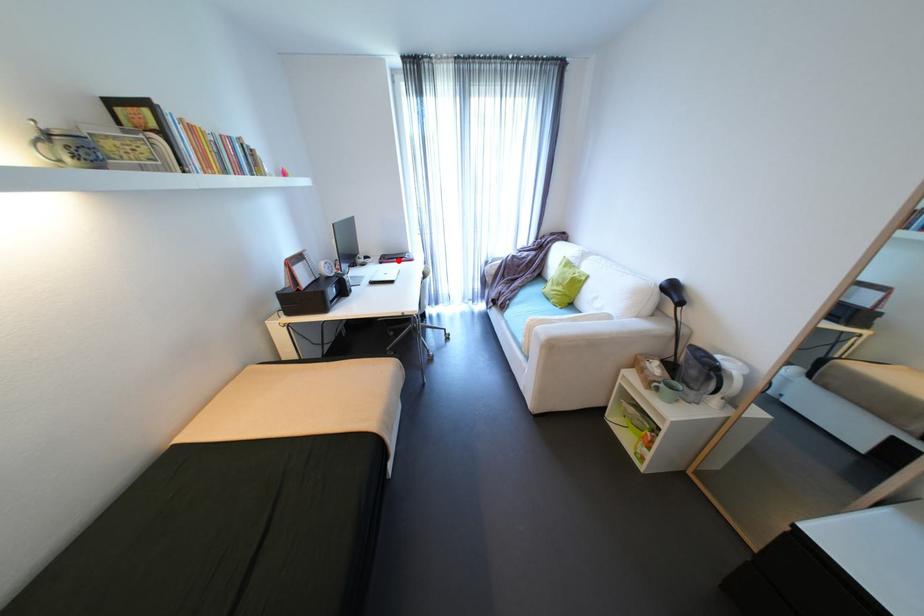
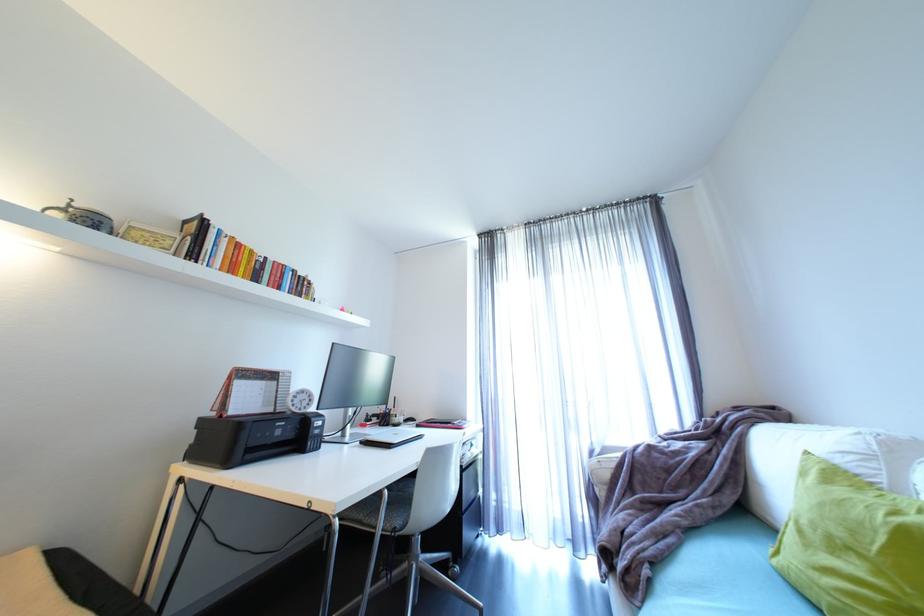
Locate, in the second image, the point that corresponds to the highlighted location in the first image.

(440, 424)